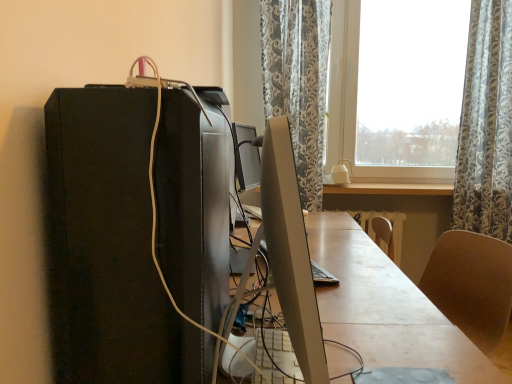
Question: Does light wood table at center come behind satin silver monitor at center?

Choices:
 (A) no
 (B) yes

Answer: (B)

Question: Does light wood table at center have a larger size compared to satin silver monitor at center?

Choices:
 (A) yes
 (B) no

Answer: (B)

Question: Is light wood table at center not within satin silver monitor at center?

Choices:
 (A) yes
 (B) no

Answer: (A)

Question: Could you tell me if light wood table at center is facing satin silver monitor at center?

Choices:
 (A) yes
 (B) no

Answer: (B)

Question: Can you confirm if light wood table at center is wider than satin silver monitor at center?

Choices:
 (A) yes
 (B) no

Answer: (A)

Question: Would you say satin silver monitor at center is to the left or to the right of smooth wooden desk at center in the picture?

Choices:
 (A) left
 (B) right

Answer: (A)

Question: Is point (272, 279) closer or farther from the camera than point (390, 354)?

Choices:
 (A) farther
 (B) closer

Answer: (A)

Question: Considering the positions of satin silver monitor at center and smooth wooden desk at center in the image, is satin silver monitor at center wider or thinner than smooth wooden desk at center?

Choices:
 (A) wide
 (B) thin

Answer: (B)

Question: Considering their positions, is satin silver monitor at center located in front of or behind smooth wooden desk at center?

Choices:
 (A) front
 (B) behind

Answer: (A)

Question: Considering the positions of light wood table at center and black matte computer tower at left in the image, is light wood table at center bigger or smaller than black matte computer tower at left?

Choices:
 (A) big
 (B) small

Answer: (B)

Question: Is light wood table at center in front of or behind black matte computer tower at left in the image?

Choices:
 (A) front
 (B) behind

Answer: (B)

Question: From a real-world perspective, is light wood table at center physically located above or below black matte computer tower at left?

Choices:
 (A) below
 (B) above

Answer: (A)

Question: Is light wood table at center inside the boundaries of black matte computer tower at left, or outside?

Choices:
 (A) inside
 (B) outside

Answer: (B)

Question: Is smooth wooden desk at center in front of or behind black matte computer tower at left in the image?

Choices:
 (A) front
 (B) behind

Answer: (B)

Question: From a real-world perspective, is smooth wooden desk at center physically located above or below black matte computer tower at left?

Choices:
 (A) below
 (B) above

Answer: (A)